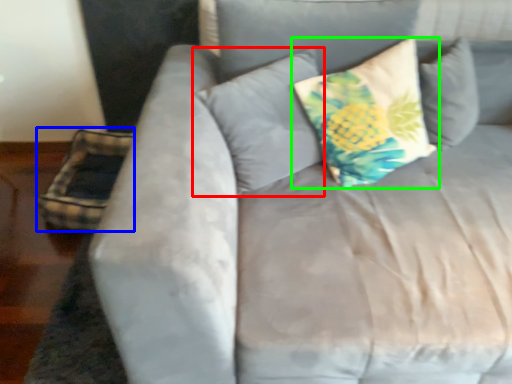
Question: Which object is positioned closest to pillow (highlighted by a red box)? Select from pillow (highlighted by a blue box) and pillow (highlighted by a green box).

Choices:
 (A) pillow
 (B) pillow

Answer: (B)